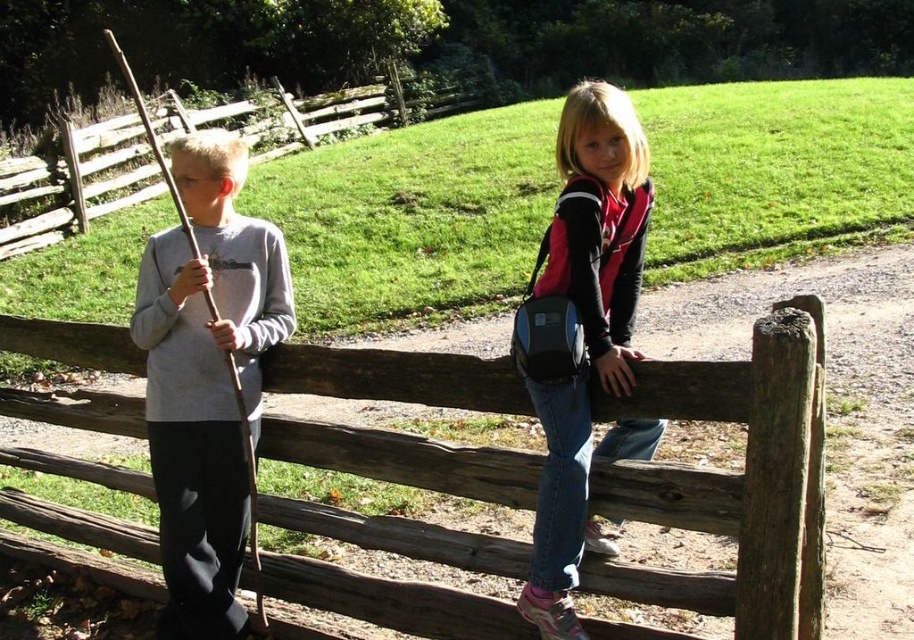
You are a photographer trying to capture a photo of the two children standing beside the rustic wooden fence. You notice two points marked in the scene at coordinates point (x=411, y=538) and point (x=158, y=532). Which of these points is positioned closer to your camera lens?

Point (x=411, y=538) is closer to the viewer than point (x=158, y=532), so the photographer should focus on that point as it is nearer to the camera lens.

You are a photographer trying to capture a photo of the weathered wood fence at center and the denim jeans at center. Since you want to focus on the fence, which object should you adjust your camera focus to prioritize?

The weathered wood fence at center is in front of denim jeans at center, so you should focus on the weathered wood fence at center to ensure it is the main subject in focus.